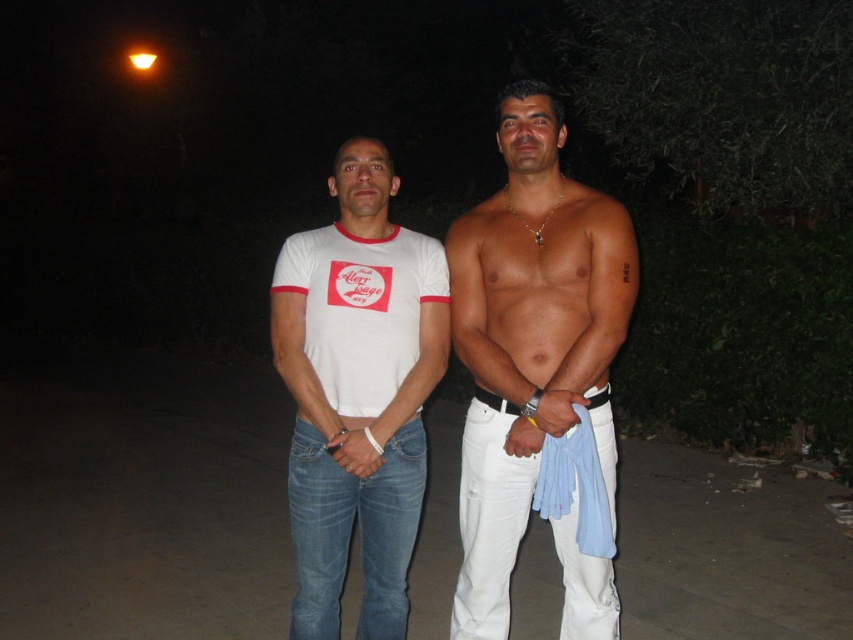
Based on the photo, what is located at the coordinates point [527,336] in the image?

At point [527,336] lies smooth white pants at center.

You are a photographer setting up a night shoot in the described scene. You notice the smooth white pants at center and the black leather belt at center. Which item is covering part of the other?

The smooth white pants at center is positioned over the black leather belt at center, so the smooth white pants at center is covering part of the black leather belt at center.